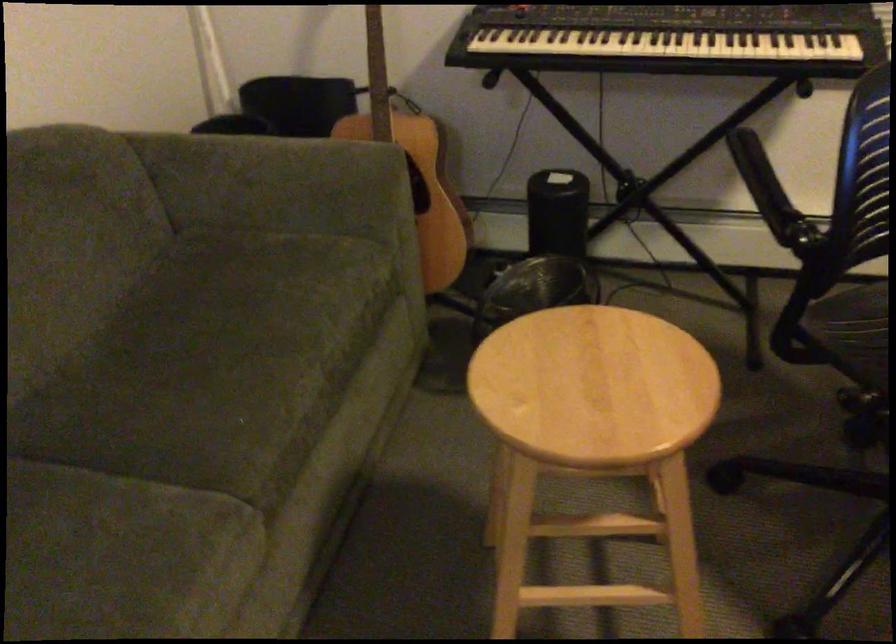
You are a GUI agent. You are given a task and a screenshot of the screen. Output one action in this format:
    pyautogui.click(x=<x>, y=<y>)
    Task: Click on the chair armrest
    This screenshot has height=644, width=896.
    Given the screenshot: What is the action you would take?
    pos(769,193)